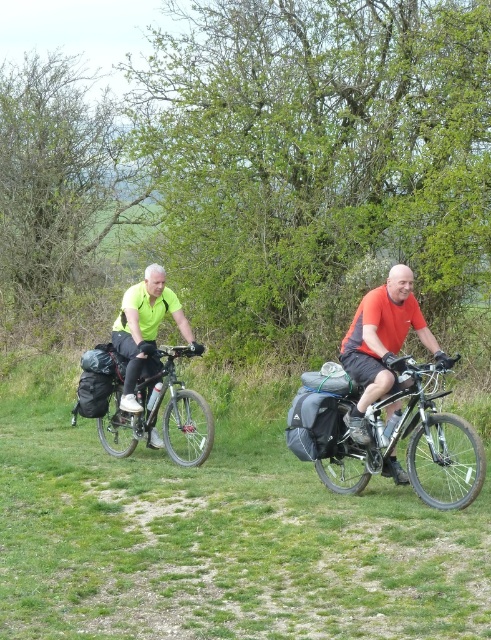
Who is positioned more to the left, shiny metallic bicycle at center or silver metallic bicycle at center-left?

Positioned to the left is silver metallic bicycle at center-left.

In order to click on shiny metallic bicycle at center in this screenshot , I will do `click(390, 436)`.

Does point (444, 419) lie in front of point (199, 410)?

Yes.

At what (x,y) coordinates should I click in order to perform the action: click on shiny metallic bicycle at center. Please return your answer as a coordinate pair (x, y). Looking at the image, I should click on (390, 436).

Does shiny metallic bicycle at center lie behind neon yellow jersey at center?

No, shiny metallic bicycle at center is in front of neon yellow jersey at center.

Can you confirm if shiny metallic bicycle at center is bigger than neon yellow jersey at center?

Indeed, shiny metallic bicycle at center has a larger size compared to neon yellow jersey at center.

Which is in front, point (374, 467) or point (129, 390)?

Positioned in front is point (374, 467).

This screenshot has width=491, height=640. What are the coordinates of `shiny metallic bicycle at center` in the screenshot? It's located at (390, 436).

Who is positioned more to the left, shiny metallic bicycle at center or matte orange shirt at center?

matte orange shirt at center

Is shiny metallic bicycle at center taller than matte orange shirt at center?

Incorrect, shiny metallic bicycle at center's height is not larger of matte orange shirt at center's.

Is point (336, 408) positioned before point (381, 296)?

No, it is not.

I want to click on shiny metallic bicycle at center, so click(x=390, y=436).